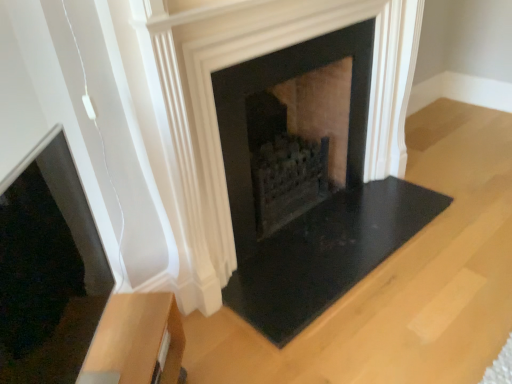
The height and width of the screenshot is (384, 512). Describe the element at coordinates (136, 342) in the screenshot. I see `light brown wood side table at lower left` at that location.

Locate an element on the screen. The width and height of the screenshot is (512, 384). light brown wood side table at lower left is located at coordinates (136, 342).

The height and width of the screenshot is (384, 512). What do you see at coordinates (277, 83) in the screenshot?
I see `black stone fireplace at center` at bounding box center [277, 83].

Identify the location of black stone fireplace at center. This screenshot has height=384, width=512. (277, 83).

Locate an element on the screen. The image size is (512, 384). light brown wood side table at lower left is located at coordinates (136, 342).

Can you confirm if black stone fireplace at center is positioned to the right of light brown wood side table at lower left?

Correct, you'll find black stone fireplace at center to the right of light brown wood side table at lower left.

Is black stone fireplace at center further to the viewer compared to light brown wood side table at lower left?

Yes.

Is point (263, 73) behind point (105, 355)?

Yes, point (263, 73) is behind point (105, 355).

From the image's perspective, which is above, black stone fireplace at center or light brown wood side table at lower left?

black stone fireplace at center appears higher in the image.

From a real-world perspective, is black stone fireplace at center positioned over light brown wood side table at lower left based on gravity?

Yes.

Can you confirm if black stone fireplace at center is thinner than light brown wood side table at lower left?

No, black stone fireplace at center is not thinner than light brown wood side table at lower left.

Is black stone fireplace at center taller than light brown wood side table at lower left?

Correct, black stone fireplace at center is much taller as light brown wood side table at lower left.

Between black stone fireplace at center and light brown wood side table at lower left, which one has larger size?

black stone fireplace at center.

Is light brown wood side table at lower left completely or partially inside black stone fireplace at center?

No, light brown wood side table at lower left is not a part of black stone fireplace at center.

Are black stone fireplace at center and light brown wood side table at lower left making contact?

They are not placed beside each other.

Is black stone fireplace at center turned away from light brown wood side table at lower left?

No, black stone fireplace at center is not facing the opposite direction of light brown wood side table at lower left.

How much distance is there between black stone fireplace at center and light brown wood side table at lower left?

They are 30.91 inches apart.

Find the location of a particular element. The image size is (512, 384). fireplace above the light brown wood side table at lower left (from a real-world perspective) is located at coordinates (277, 83).

Does light brown wood side table at lower left appear on the left side of black stone fireplace at center?

Correct, you'll find light brown wood side table at lower left to the left of black stone fireplace at center.

Does light brown wood side table at lower left come in front of black stone fireplace at center?

That is True.

Is point (139, 363) closer or farther from the camera than point (254, 81)?

Point (139, 363) is closer to the camera than point (254, 81).

From the image's perspective, which is above, light brown wood side table at lower left or black stone fireplace at center?

black stone fireplace at center, from the image's perspective.

From a real-world perspective, is light brown wood side table at lower left under black stone fireplace at center?

Yes, from a real-world perspective, light brown wood side table at lower left is beneath black stone fireplace at center.

Does light brown wood side table at lower left have a lesser width compared to black stone fireplace at center?

Indeed, light brown wood side table at lower left has a lesser width compared to black stone fireplace at center.

Does light brown wood side table at lower left have a greater height compared to black stone fireplace at center?

No, light brown wood side table at lower left is not taller than black stone fireplace at center.

Considering the sizes of objects light brown wood side table at lower left and black stone fireplace at center in the image provided, who is smaller, light brown wood side table at lower left or black stone fireplace at center?

light brown wood side table at lower left is smaller.

Is black stone fireplace at center surrounded by light brown wood side table at lower left?

Definitely not — black stone fireplace at center is not inside light brown wood side table at lower left.

Is there a large distance between light brown wood side table at lower left and black stone fireplace at center?

That's not correct — light brown wood side table at lower left is a little close to black stone fireplace at center.

Is light brown wood side table at lower left oriented away from black stone fireplace at center?

No, black stone fireplace at center is not at the back of light brown wood side table at lower left.

There is a light brown wood side table at lower left. Where is `fireplace above it (from a real-world perspective)`? Image resolution: width=512 pixels, height=384 pixels. fireplace above it (from a real-world perspective) is located at coordinates (277, 83).

Find the location of a particular element. This screenshot has height=384, width=512. fireplace above the light brown wood side table at lower left (from a real-world perspective) is located at coordinates (277, 83).

At what (x,y) coordinates should I click in order to perform the action: click on fireplace that is on the right side of light brown wood side table at lower left. Please return your answer as a coordinate pair (x, y). Looking at the image, I should click on (277, 83).